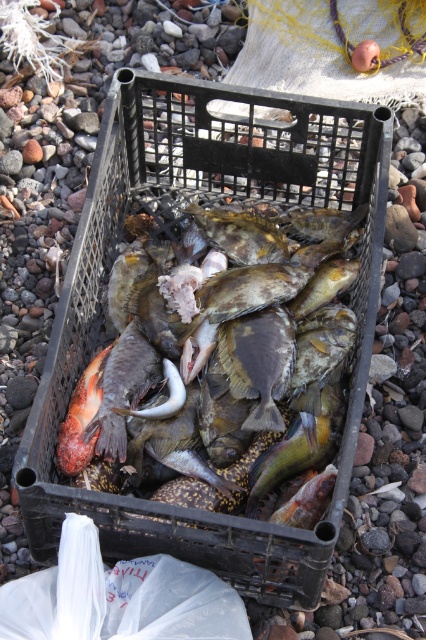
Is speckled skin fish at center thinner than shiny orange fish at lower left?

In fact, speckled skin fish at center might be wider than shiny orange fish at lower left.

Can you confirm if speckled skin fish at center is smaller than shiny orange fish at lower left?

No.

Who is more forward, (152, 346) or (81, 385)?

Point (81, 385) is more forward.

Locate an element on the screen. speckled skin fish at center is located at coordinates tap(247, 310).

Can you confirm if shiny golden fish at center is bigger than shiny orange fish at lower left?

Yes, shiny golden fish at center is bigger than shiny orange fish at lower left.

Is the position of shiny golden fish at center more distant than that of shiny orange fish at lower left?

Yes, shiny golden fish at center is further from the viewer.

Which is behind, point (276, 250) or point (74, 472)?

Positioned behind is point (276, 250).

Identify the location of shiny golden fish at center. (241, 234).

Between shiny silver fish at center and shiny orange fish at lower left, which one is positioned lower?

shiny orange fish at lower left is lower down.

Between point (126, 332) and point (89, 401), which one is positioned behind?

The point (126, 332) is more distant.

Locate an element on the screen. Image resolution: width=426 pixels, height=640 pixels. shiny silver fish at center is located at coordinates (123, 388).